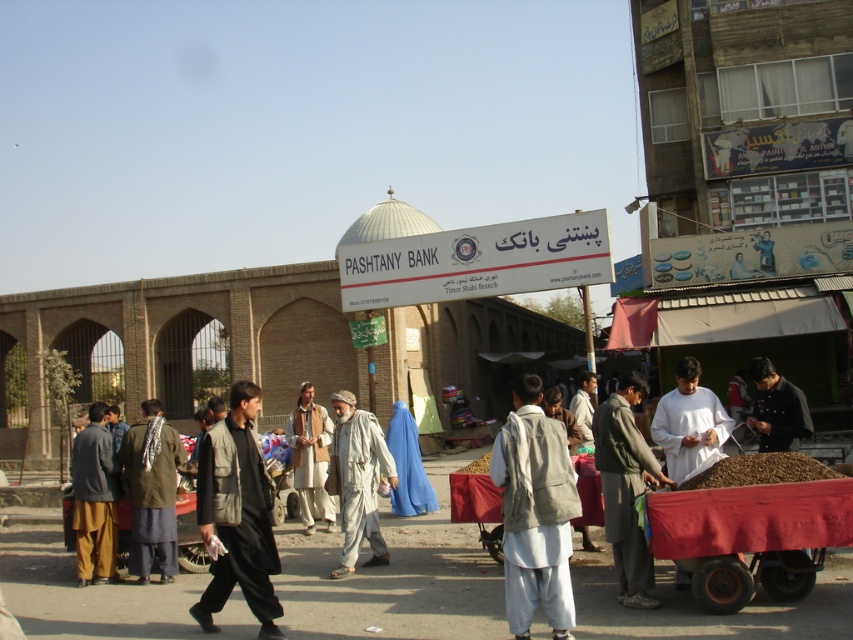
Question: Is dark gray leather jacket at center wider than dark green fabric jacket at lower left?

Choices:
 (A) yes
 (B) no

Answer: (A)

Question: Among these objects, which one is farthest from the camera?

Choices:
 (A) light brown fabric jacket at center
 (B) dark brown leather jacket at center

Answer: (A)

Question: Estimate the real-world distances between objects in this image. Which object is closer to the dark gray leather jacket at center?

Choices:
 (A) light gray fabric vest at center
 (B) white cotton shirt at center
 (C) dark green fabric jacket at lower left
 (D) light brown fabric jacket at center

Answer: (A)

Question: Which object is the farthest from the dark green fabric jacket at lower left?

Choices:
 (A) white cotton shirt at center
 (B) dark brown leather jacket at center
 (C) brown woolen jacket at center

Answer: (B)

Question: Can you confirm if dark gray fabric cart at lower right is positioned above dark green fabric jacket at lower left?

Choices:
 (A) yes
 (B) no

Answer: (A)

Question: Considering the relative positions of dark gray leather jacket at center and brown woolen jacket at center in the image provided, where is dark gray leather jacket at center located with respect to brown woolen jacket at center?

Choices:
 (A) above
 (B) below

Answer: (A)